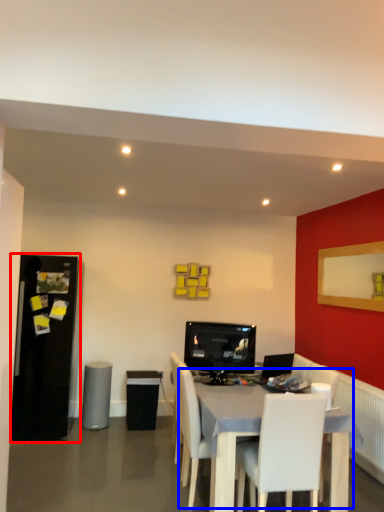
Question: Which object appears farthest to the camera in this image, fridge (highlighted by a red box) or table (highlighted by a blue box)?

Choices:
 (A) fridge
 (B) table

Answer: (A)